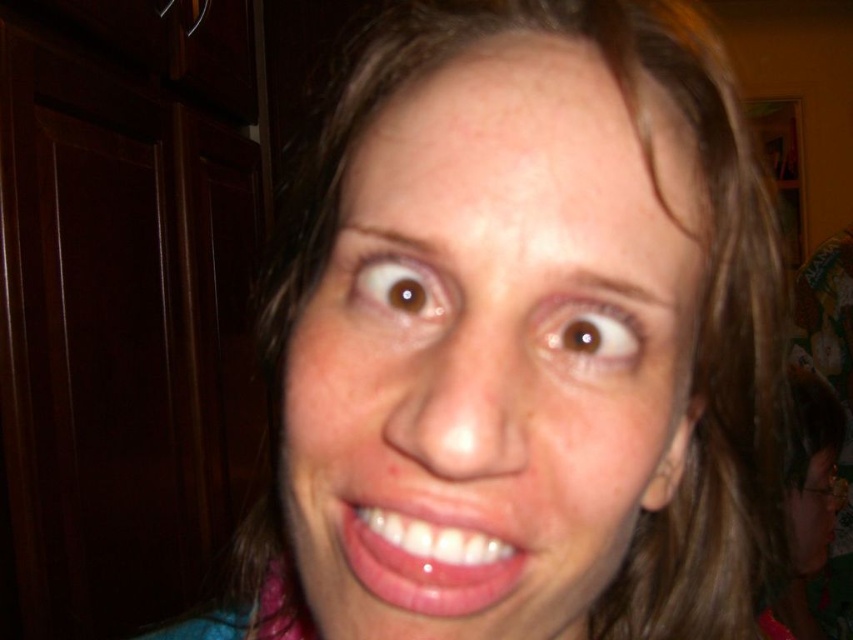
Question: Is natural skin tone at center bigger than glossy pink lips at center?

Choices:
 (A) yes
 (B) no

Answer: (A)

Question: Which object appears closest to the camera in this image?

Choices:
 (A) natural skin tone at center
 (B) glossy pink lips at center

Answer: (A)

Question: Does natural skin tone at center appear on the left side of glossy pink lips at center?

Choices:
 (A) yes
 (B) no

Answer: (B)

Question: Among these objects, which one is nearest to the camera?

Choices:
 (A) glossy pink lips at center
 (B) natural skin tone at center

Answer: (B)

Question: Is natural skin tone at center positioned in front of glossy pink lips at center?

Choices:
 (A) yes
 (B) no

Answer: (A)